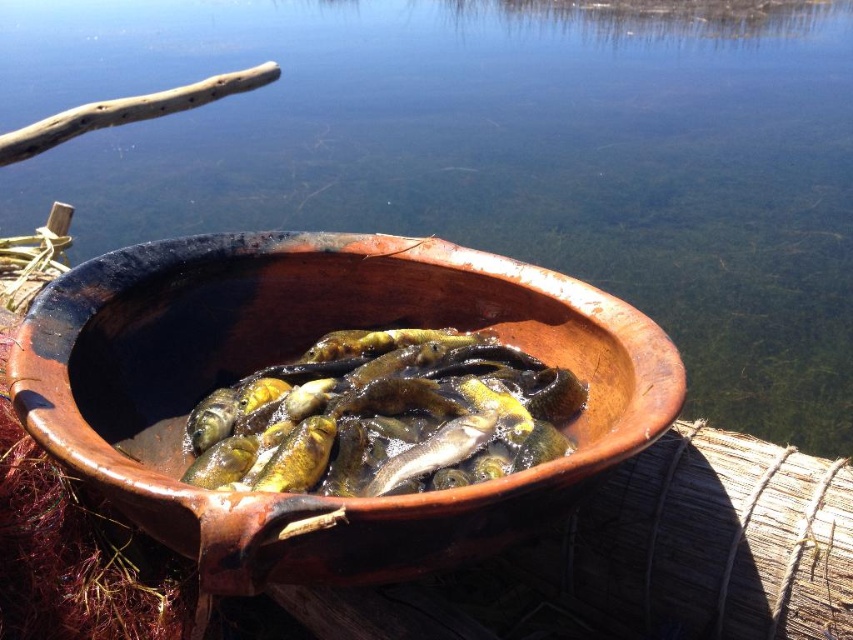
Does point (422, 371) come behind point (469, 435)?

That is True.

Can you confirm if yellow-green scales at center is smaller than shiny silver fish at center?

No.

Identify the location of yellow-green scales at center. (384, 417).

In the scene shown: Can you confirm if clear water at center is thinner than shiny silver fish at center?

No.

Does clear water at center lie behind shiny silver fish at center?

No, clear water at center is closer to the viewer.

Between point (277, 109) and point (422, 470), which one is positioned behind?

Positioned behind is point (277, 109).

The height and width of the screenshot is (640, 853). Find the location of `clear water at center`. clear water at center is located at coordinates (491, 157).

Can you confirm if yellow-green scales at center is smaller than shiny golden fish at center?

Incorrect, yellow-green scales at center is not smaller in size than shiny golden fish at center.

Does yellow-green scales at center have a lesser height compared to shiny golden fish at center?

Incorrect, yellow-green scales at center's height does not fall short of shiny golden fish at center's.

This screenshot has width=853, height=640. What do you see at coordinates (384, 417) in the screenshot? I see `yellow-green scales at center` at bounding box center [384, 417].

Where is `yellow-green scales at center`? yellow-green scales at center is located at coordinates (384, 417).